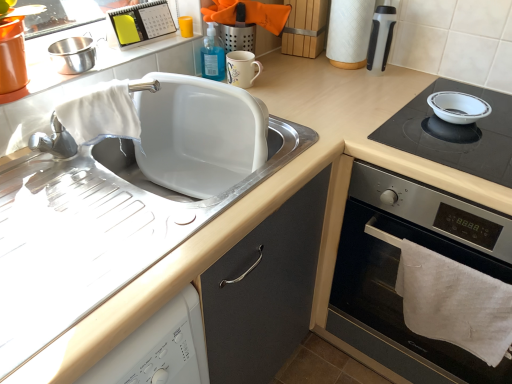
Question: Considering the relative sizes of black glass cooktop at right and white cotton towel at lower right in the image provided, is black glass cooktop at right taller than white cotton towel at lower right?

Choices:
 (A) yes
 (B) no

Answer: (A)

Question: From a real-world perspective, is black glass cooktop at right on white cotton towel at lower right?

Choices:
 (A) yes
 (B) no

Answer: (B)

Question: Is black glass cooktop at right bigger than white cotton towel at lower right?

Choices:
 (A) yes
 (B) no

Answer: (A)

Question: Does black glass cooktop at right have a smaller size compared to white cotton towel at lower right?

Choices:
 (A) no
 (B) yes

Answer: (A)

Question: Considering the relative sizes of black glass cooktop at right and white cotton towel at lower right in the image provided, is black glass cooktop at right wider than white cotton towel at lower right?

Choices:
 (A) yes
 (B) no

Answer: (A)

Question: Looking at their shapes, would you say white glossy bowl at upper right is wider or thinner than white matte sink at left?

Choices:
 (A) thin
 (B) wide

Answer: (B)

Question: Considering the positions of white glossy bowl at upper right and white matte sink at left in the image, is white glossy bowl at upper right bigger or smaller than white matte sink at left?

Choices:
 (A) small
 (B) big

Answer: (A)

Question: Is point (474, 92) positioned closer to the camera than point (122, 173)?

Choices:
 (A) closer
 (B) farther

Answer: (B)

Question: From the image's perspective, is white glossy bowl at upper right positioned above or below white matte sink at left?

Choices:
 (A) above
 (B) below

Answer: (A)

Question: Is white paper towel at upper right inside or outside of white matte sink at left?

Choices:
 (A) outside
 (B) inside

Answer: (A)

Question: Considering their positions, is white paper towel at upper right located in front of or behind white matte sink at left?

Choices:
 (A) front
 (B) behind

Answer: (B)

Question: Is white paper towel at upper right taller or shorter than white matte sink at left?

Choices:
 (A) tall
 (B) short

Answer: (B)

Question: In the image, is white paper towel at upper right on the left side or the right side of white matte sink at left?

Choices:
 (A) right
 (B) left

Answer: (A)

Question: In terms of width, does black glass cooktop at right look wider or thinner when compared to white glossy bowl at upper right?

Choices:
 (A) thin
 (B) wide

Answer: (B)

Question: Considering the positions of point (466, 238) and point (413, 115), is point (466, 238) closer or farther from the camera than point (413, 115)?

Choices:
 (A) closer
 (B) farther

Answer: (A)